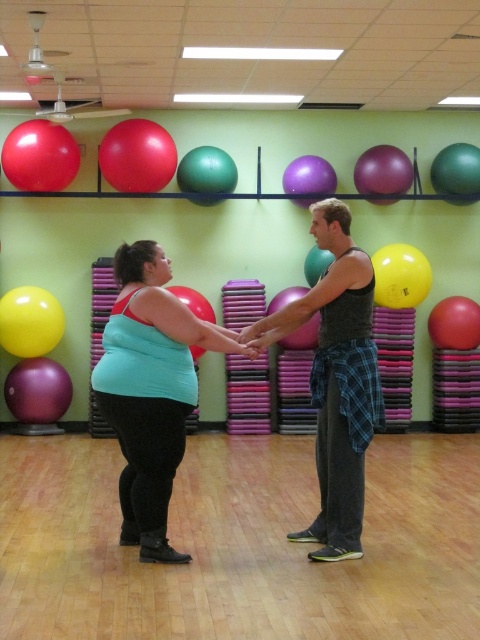
Question: Which point appears closest to the camera in this image?

Choices:
 (A) (296, 348)
 (B) (377, 192)
 (C) (474, 312)
 (D) (7, 308)

Answer: (D)

Question: Does purple matte balloon at upper center have a greater width compared to rubber exercise ball at center?

Choices:
 (A) no
 (B) yes

Answer: (B)

Question: Which point is closer to the camera?

Choices:
 (A) green rubber balloon at center
 (B) rubberized red ball at center

Answer: (B)

Question: Does rubber exercise ball at upper left come in front of yellow matte balloon at upper center?

Choices:
 (A) no
 (B) yes

Answer: (B)

Question: Which of the following is the farthest from the observer?

Choices:
 (A) (19, 340)
 (B) (141, 172)

Answer: (A)

Question: Can you confirm if matte teal tank top at center is thinner than rubber exercise ball at center?

Choices:
 (A) yes
 (B) no

Answer: (B)